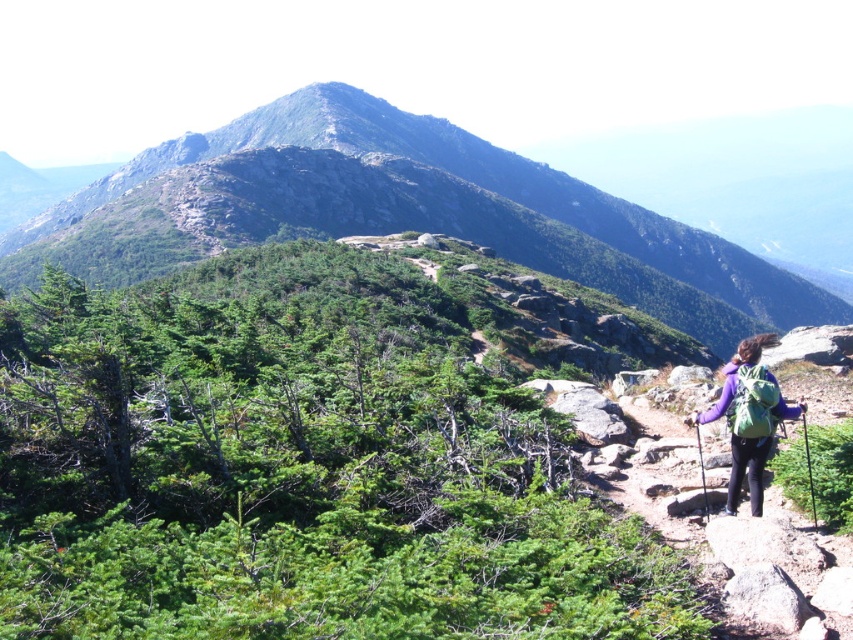
Can you confirm if green rocky mountain at center is taller than purple fabric backpack at lower right?

Yes.

Who is lower down, green rocky mountain at center or purple fabric backpack at lower right?

purple fabric backpack at lower right is below.

Which is in front, point (321, 179) or point (758, 378)?

Positioned in front is point (758, 378).

Identify the location of green rocky mountain at center. (402, 212).